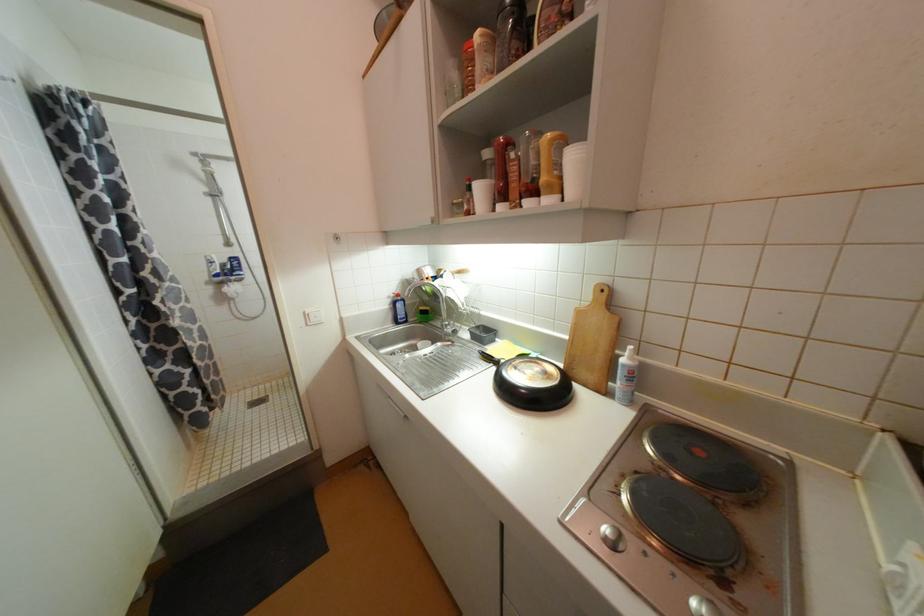
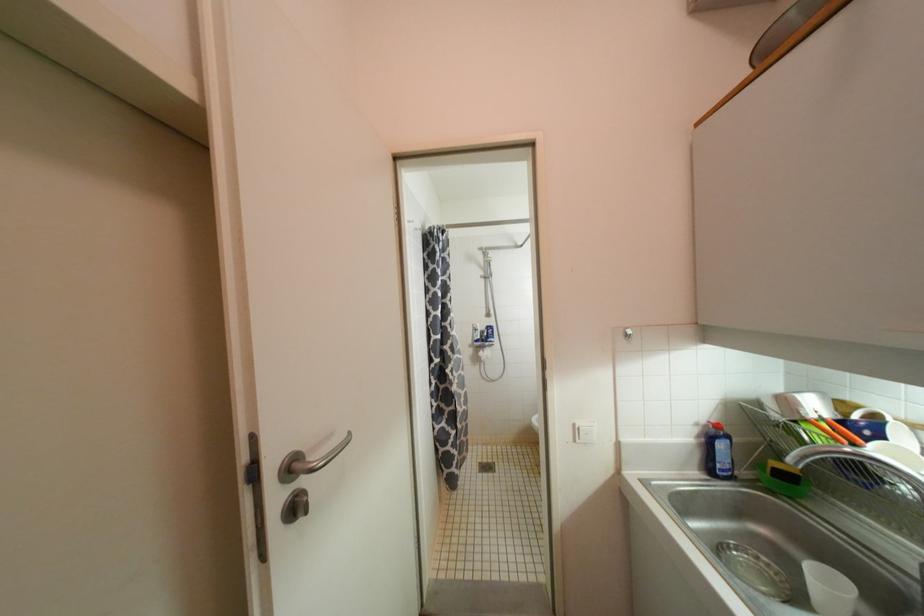
Question: The first image is from the beginning of the video and the second image is from the end. How did the camera likely rotate when shooting the video?

Choices:
 (A) Left
 (B) Right
 (C) Up
 (D) Down

Answer: (A)